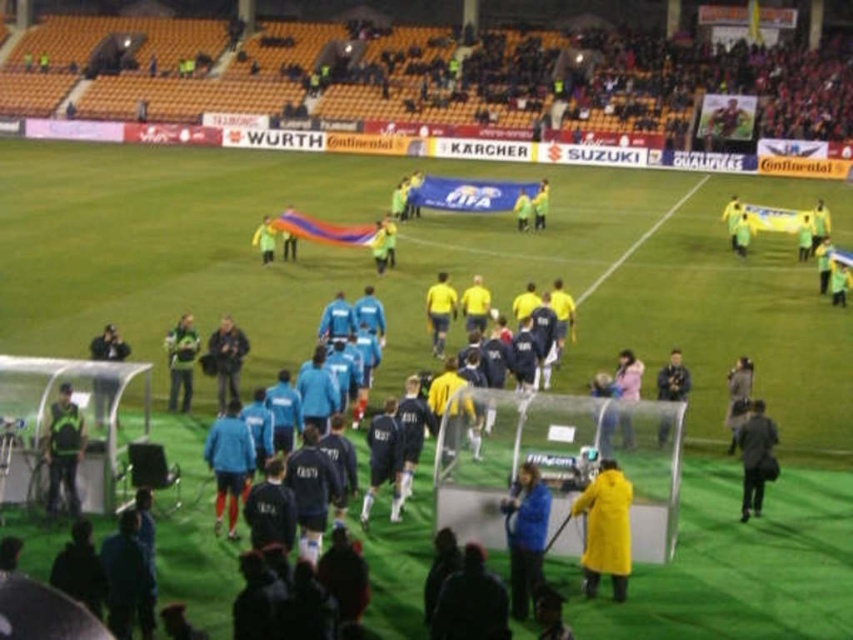
Does black matte jacket at lower right appear on the left side of black leather jacket at center?

In fact, black matte jacket at lower right is to the right of black leather jacket at center.

Can you confirm if black matte jacket at lower right is taller than black leather jacket at center?

Yes.

Image resolution: width=853 pixels, height=640 pixels. Identify the location of black matte jacket at lower right. (756, 458).

The width and height of the screenshot is (853, 640). Find the location of `blue matte jacket at center`. blue matte jacket at center is located at coordinates (525, 536).

Is point (538, 544) less distant than point (743, 444)?

Yes, it is in front of point (743, 444).

Find the location of `blue matte jacket at center`. blue matte jacket at center is located at coordinates (525, 536).

In the scene shown: Can you confirm if green jersey at center is taller than dark blue jacket at lower left?

Indeed, green jersey at center has a greater height compared to dark blue jacket at lower left.

Does green jersey at center have a larger size compared to dark blue jacket at lower left?

Indeed, green jersey at center has a larger size compared to dark blue jacket at lower left.

Locate an element on the screen. green jersey at center is located at coordinates (181, 362).